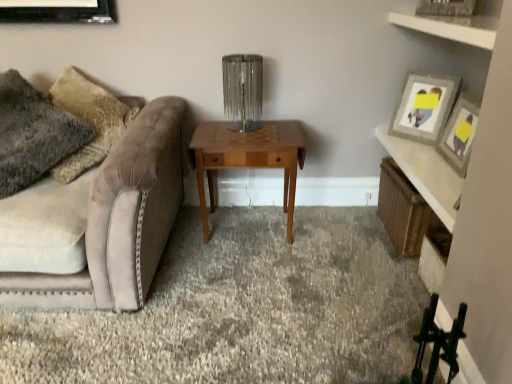
Where is `free region under clear glass table lamp at center (from a real-world perspective)`? Image resolution: width=512 pixels, height=384 pixels. free region under clear glass table lamp at center (from a real-world perspective) is located at coordinates (241, 131).